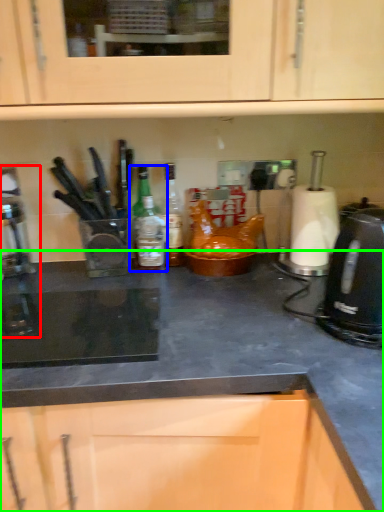
Question: Which object is the farthest from coffee machine (highlighted by a red box)? Choose among these: kitchen appliance (highlighted by a blue box) or countertop (highlighted by a green box).

Choices:
 (A) kitchen appliance
 (B) countertop

Answer: (B)